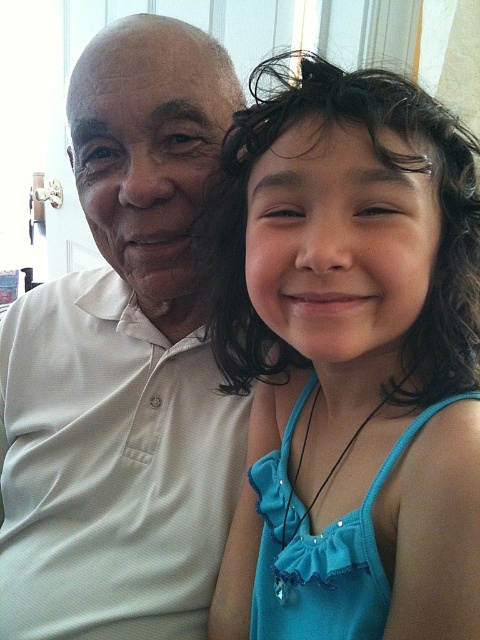
Can you confirm if blue satin dress at right is smaller than white matte shirt at left?

Yes, blue satin dress at right is smaller than white matte shirt at left.

Does blue satin dress at right appear under white matte shirt at left?

Correct, blue satin dress at right is located below white matte shirt at left.

Who is more forward, (424, 413) or (149, 536)?

Point (424, 413)

What are the coordinates of `blue satin dress at right` in the screenshot? It's located at (350, 360).